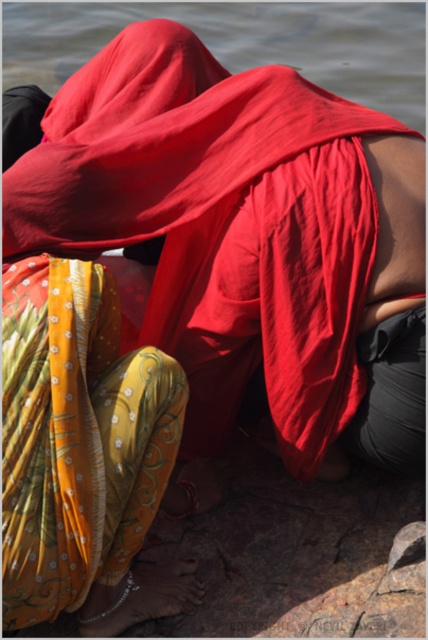
Which is below, yellow floral fabric at lower left or transparent water at upper center?

yellow floral fabric at lower left

Who is more forward, (351, 358) or (415, 76)?

Point (351, 358) is more forward.

Where is `yellow floral fabric at lower left`? Image resolution: width=428 pixels, height=640 pixels. yellow floral fabric at lower left is located at coordinates (246, 237).